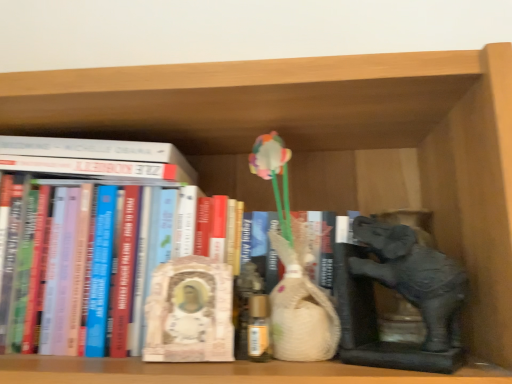
Question: In terms of height, does white marble statue at center look taller or shorter compared to matte gray elephant at right?

Choices:
 (A) short
 (B) tall

Answer: (A)

Question: From a real-world perspective, is white marble statue at center positioned above or below matte gray elephant at right?

Choices:
 (A) below
 (B) above

Answer: (A)

Question: Based on their relative distances, which object is farther from the hardcover book at center, which appears as the second book when viewed from the top?

Choices:
 (A) white matte book at upper left, the second book positioned from the bottom
 (B) matte gray elephant at right
 (C) white marble statue at center

Answer: (B)

Question: Estimate the real-world distances between objects in this image. Which object is closer to the matte gray elephant at right?

Choices:
 (A) white matte book at upper left, which appears as the 1th book when viewed from the top
 (B) white marble statue at center
 (C) hardcover book at center, the first book from the bottom

Answer: (B)